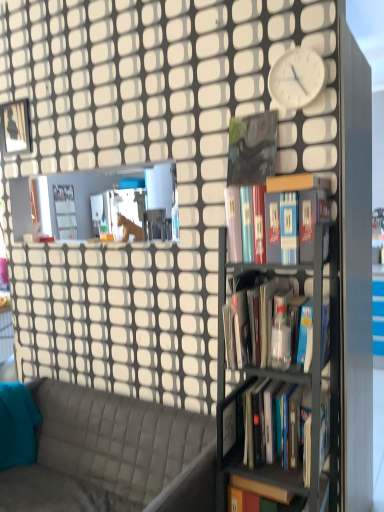
Question: Considering the positions of matte black book at center, the third book when ordered from top to bottom, and black matte book at center, which appears as the 1th book when viewed from the top, in the image, is matte black book at center, the third book when ordered from top to bottom, wider or thinner than black matte book at center, which appears as the 1th book when viewed from the top,?

Choices:
 (A) thin
 (B) wide

Answer: (B)

Question: Based on their sizes in the image, would you say matte black book at center, the 2th book from the bottom, is bigger or smaller than black matte book at center, which appears as the 1th book when viewed from the top?

Choices:
 (A) small
 (B) big

Answer: (B)

Question: Which is farther from the hardcover books at center, the 4th book in the top-to-bottom sequence?

Choices:
 (A) black matte book at center, which appears as the 1th book when viewed from the top
 (B) metallic gray bookshelf at right
 (C) matte black book at center, the third book when ordered from top to bottom
 (D) hardcover book at center, which is the 3th book from bottom to top
 (E) white matte clock at upper right

Answer: (E)

Question: Which object is positioned closest to the teal fabric pillow at left?

Choices:
 (A) hardcover book at center, which is the 3th book from bottom to top
 (B) white matte clock at upper right
 (C) gray quilted fabric couch at lower left
 (D) matte black book at center, the 2th book from the bottom
 (E) metallic gray bookshelf at right

Answer: (C)